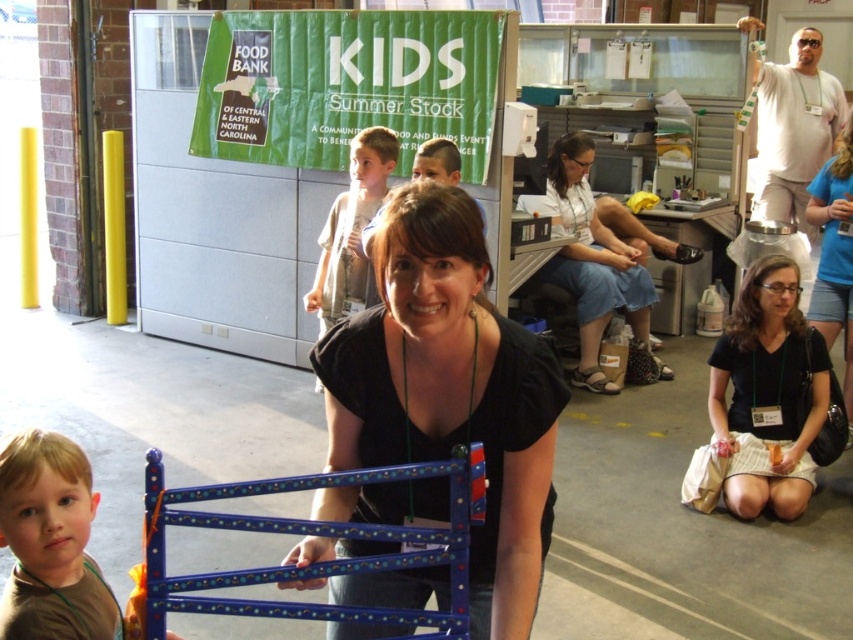
Does matte black shirt at center appear on the right side of black fabric shirt at center?

In fact, matte black shirt at center is to the left of black fabric shirt at center.

Can you confirm if matte black shirt at center is positioned above black fabric shirt at center?

Incorrect, matte black shirt at center is not positioned above black fabric shirt at center.

Between point (534, 349) and point (839, 304), which one is positioned behind?

The point (839, 304) is more distant.

Locate an element on the screen. matte black shirt at center is located at coordinates (450, 392).

Is denim skirt at center wider than light brown hair at center?

Yes.

Can you confirm if denim skirt at center is taller than light brown hair at center?

Yes.

This screenshot has height=640, width=853. Find the location of `denim skirt at center`. denim skirt at center is located at coordinates (599, 257).

Based on the photo, who is more forward, (488, 624) or (18, 609)?

Point (18, 609)

Is matte black shirt at center shorter than brown matte shirt at lower left?

In fact, matte black shirt at center may be taller than brown matte shirt at lower left.

I want to click on matte black shirt at center, so click(450, 392).